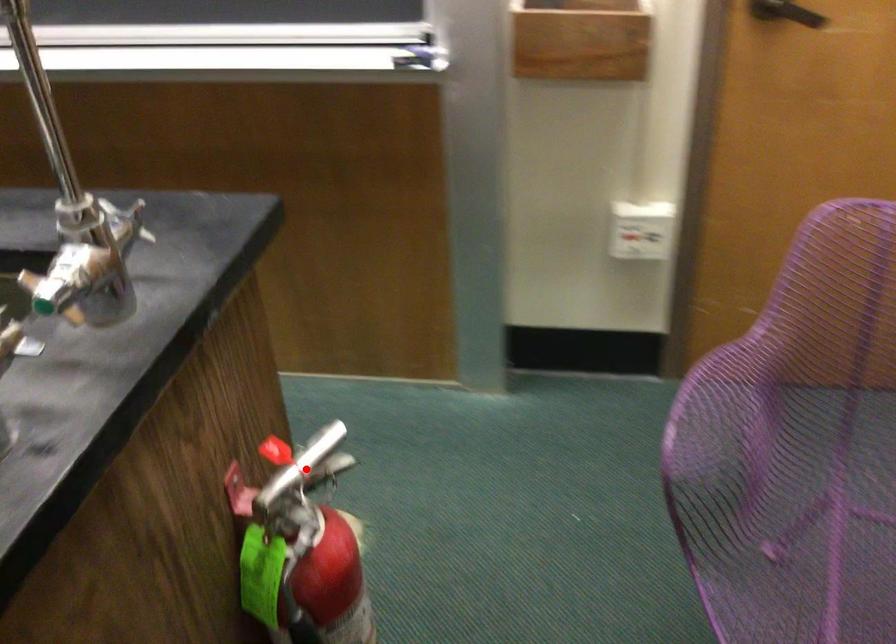
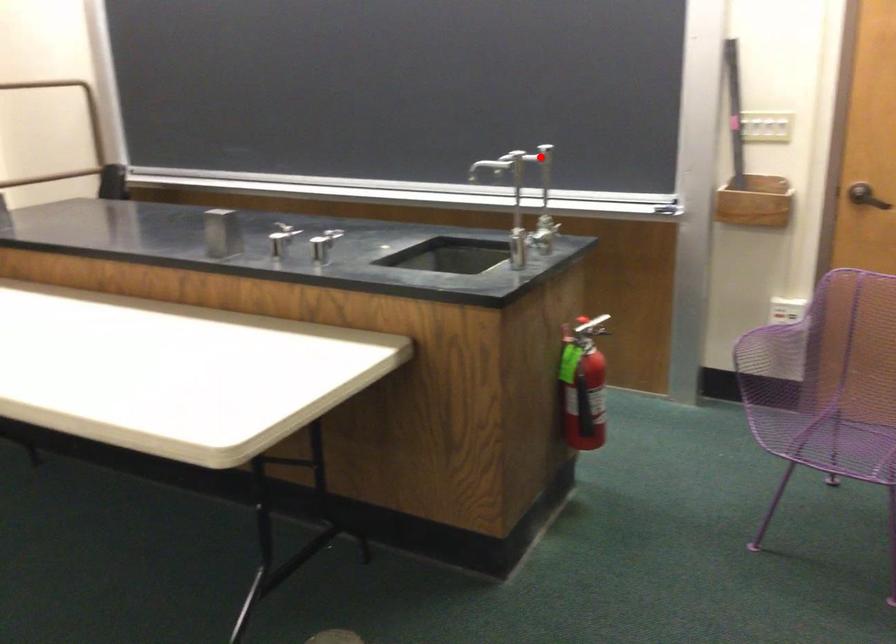
I am providing you with two images of the same scene from different viewpoints. A red point is marked on the first image and another point is marked on the second image. Is the red point in image1 aligned with the point shown in image2?

No